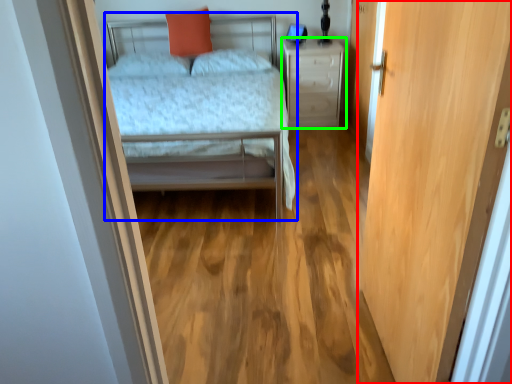
Question: Which is nearer to the door (highlighted by a red box)? bed (highlighted by a blue box) or nightstand (highlighted by a green box).

Choices:
 (A) bed
 (B) nightstand

Answer: (A)